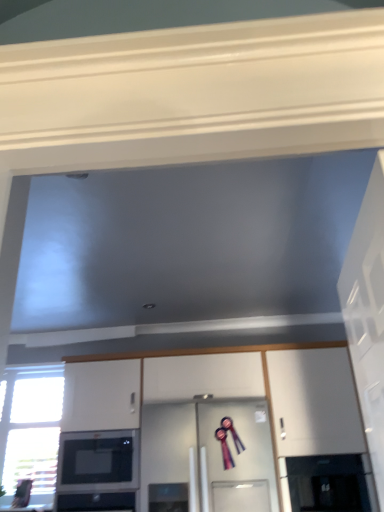
Question: Is white glossy door at right to the right of transparent glass door at lower right, which is counted as the second glass door, starting from the left, from the viewer's perspective?

Choices:
 (A) yes
 (B) no

Answer: (B)

Question: From a real-world perspective, is white glossy door at right below transparent glass door at lower right, which is counted as the second glass door, starting from the left?

Choices:
 (A) no
 (B) yes

Answer: (A)

Question: Can we say white glossy door at right lies outside transparent glass door at lower right, marked as the first glass door in a right-to-left arrangement?

Choices:
 (A) no
 (B) yes

Answer: (B)

Question: From a real-world perspective, does white glossy door at right stand above transparent glass door at lower right, which is counted as the second glass door, starting from the left?

Choices:
 (A) no
 (B) yes

Answer: (B)

Question: From the image's perspective, is white glossy door at right located beneath transparent glass door at lower right, marked as the first glass door in a right-to-left arrangement?

Choices:
 (A) no
 (B) yes

Answer: (A)

Question: In the image, is clear glass window at lower left positioned in front of or behind white glossy door at right?

Choices:
 (A) behind
 (B) front

Answer: (A)

Question: Which is correct: clear glass window at lower left is inside white glossy door at right, or outside of it?

Choices:
 (A) inside
 (B) outside

Answer: (B)

Question: Is point (29, 394) closer or farther from the camera than point (365, 323)?

Choices:
 (A) closer
 (B) farther

Answer: (B)

Question: In terms of width, does clear glass window at lower left look wider or thinner when compared to white glossy door at right?

Choices:
 (A) wide
 (B) thin

Answer: (B)

Question: Is point tap(360, 392) positioned closer to the camera than point tap(142, 444)?

Choices:
 (A) farther
 (B) closer

Answer: (B)

Question: In the image, is white glossy door at right on the left side or the right side of clear glass door at center, which is the 2th glass door from right to left?

Choices:
 (A) right
 (B) left

Answer: (A)

Question: From their relative heights in the image, would you say white glossy door at right is taller or shorter than clear glass door at center, arranged as the first glass door when viewed from the left?

Choices:
 (A) tall
 (B) short

Answer: (B)

Question: Looking at the image, does white glossy door at right seem bigger or smaller compared to clear glass door at center, which is the 2th glass door from right to left?

Choices:
 (A) small
 (B) big

Answer: (A)

Question: Is white glossy cabinet at center wider or thinner than black glossy microwave at lower left?

Choices:
 (A) wide
 (B) thin

Answer: (A)

Question: In the image, is white glossy cabinet at center positioned in front of or behind black glossy microwave at lower left?

Choices:
 (A) behind
 (B) front

Answer: (B)